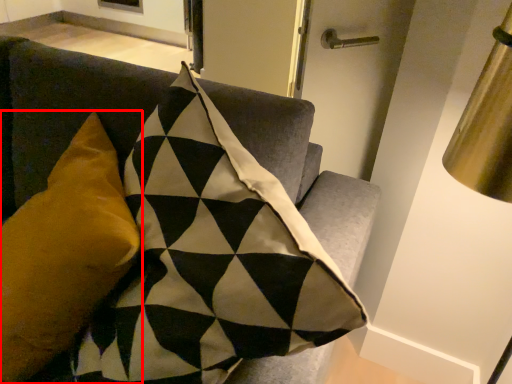
Question: From the image's perspective, where is pillow (annotated by the red box) located relative to furniture?

Choices:
 (A) above
 (B) below

Answer: (A)